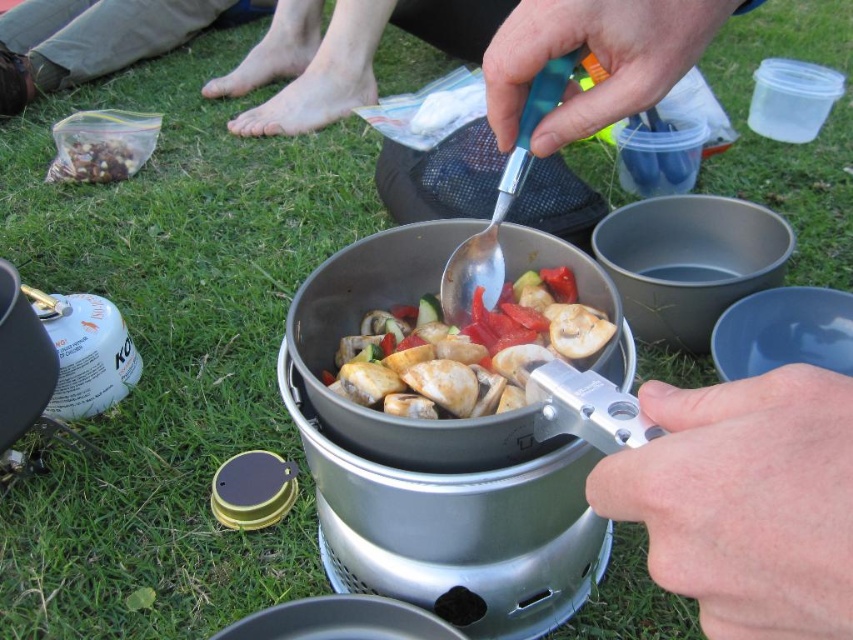
Question: Which is farther from the teal plastic spoon at upper center?

Choices:
 (A) barefoot skin at upper center
 (B) brown crumbly mix at upper left
 (C) shiny metallic mushrooms at center

Answer: (C)

Question: Can you confirm if metallic silver knife at center is positioned above teal plastic spoon at upper center?

Choices:
 (A) no
 (B) yes

Answer: (A)

Question: Which of the following is the farthest from the observer?

Choices:
 (A) barefoot skin at upper center
 (B) metallic silver knife at center
 (C) brown crumbly mix at upper left

Answer: (A)

Question: Can you confirm if metallic silver knife at center is positioned to the right of teal plastic spoon at upper center?

Choices:
 (A) yes
 (B) no

Answer: (A)

Question: Is metallic silver knife at center to the left of brown crumbly mix at upper left from the viewer's perspective?

Choices:
 (A) no
 (B) yes

Answer: (A)

Question: Estimate the real-world distances between objects in this image. Which object is closer to the teal plastic spoon at upper center?

Choices:
 (A) brown crumbly mix at upper left
 (B) barefoot skin at upper center

Answer: (A)